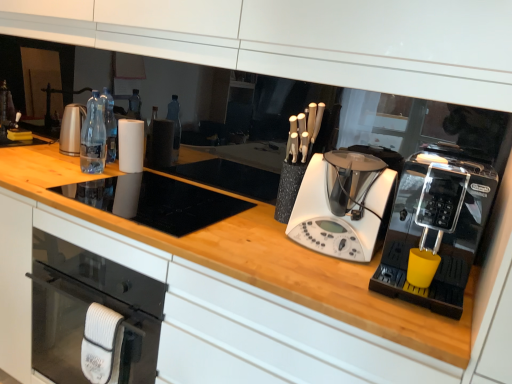
At what (x,y) coordinates should I click in order to perform the action: click on free region on the left part of black plastic coffee machine at right, which is the 1th home appliance from right to left. Please return your answer as a coordinate pair (x, y). Looking at the image, I should click on (308, 266).